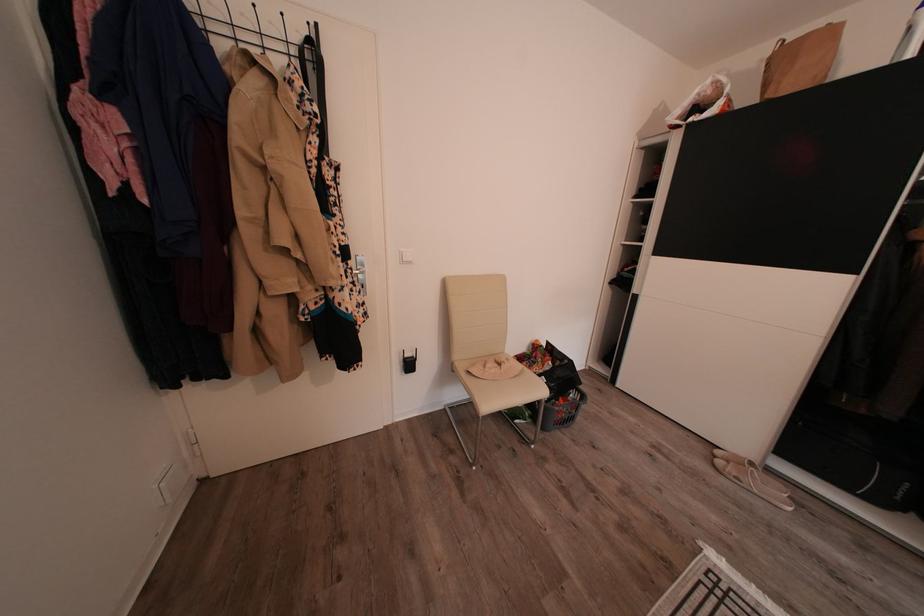
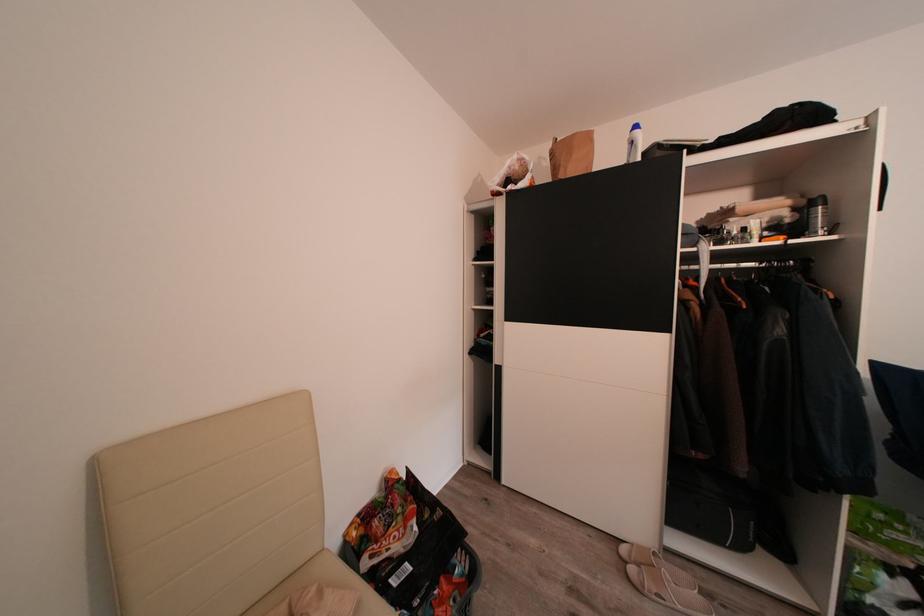
Question: The images are taken continuously from a first-person perspective. In which direction is your viewpoint rotating?

Choices:
 (A) Left
 (B) Right
 (C) Up
 (D) Down

Answer: (B)